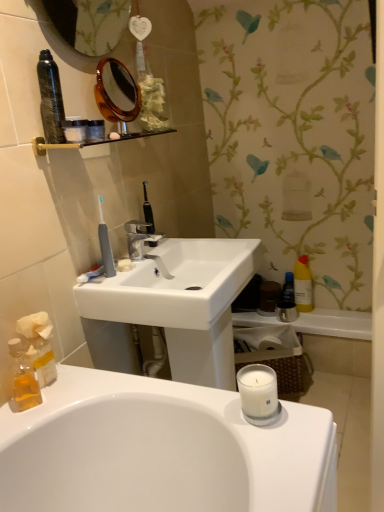
Question: From a real-world perspective, relative to matte silver faucet at center, is blue glossy mouthwash at right, which is the 1th mouthwash in back-to-front order, vertically above or below?

Choices:
 (A) below
 (B) above

Answer: (A)

Question: Is blue glossy mouthwash at right, which is the 1th mouthwash in back-to-front order, inside the boundaries of matte silver faucet at center, or outside?

Choices:
 (A) inside
 (B) outside

Answer: (B)

Question: Estimate the real-world distances between objects in this image. Which object is closer to the white paper tissue at lower left?

Choices:
 (A) tortoiseshell plastic mirror at upper center, which is counted as the 2th mirror, starting from the top
 (B) translucent amber liquid at lower left, placed as the second mouthwash when sorted from back to front
 (C) white matte soap at center
 (D) yellow matte bottle at right
 (E) metallic silver bath at lower right

Answer: (B)

Question: Estimate the real-world distances between objects in this image. Which object is farther from the yellow matte bottle at right?

Choices:
 (A) matte glass mirror at upper left, placed as the 2th mirror when sorted from bottom to top
 (B) tortoiseshell plastic mirror at upper center, which is counted as the 2th mirror, starting from the top
 (C) matte silver faucet at center
 (D) metallic silver bath at lower right
 (E) translucent amber liquid at lower left, placed as the second mouthwash when sorted from back to front

Answer: (E)